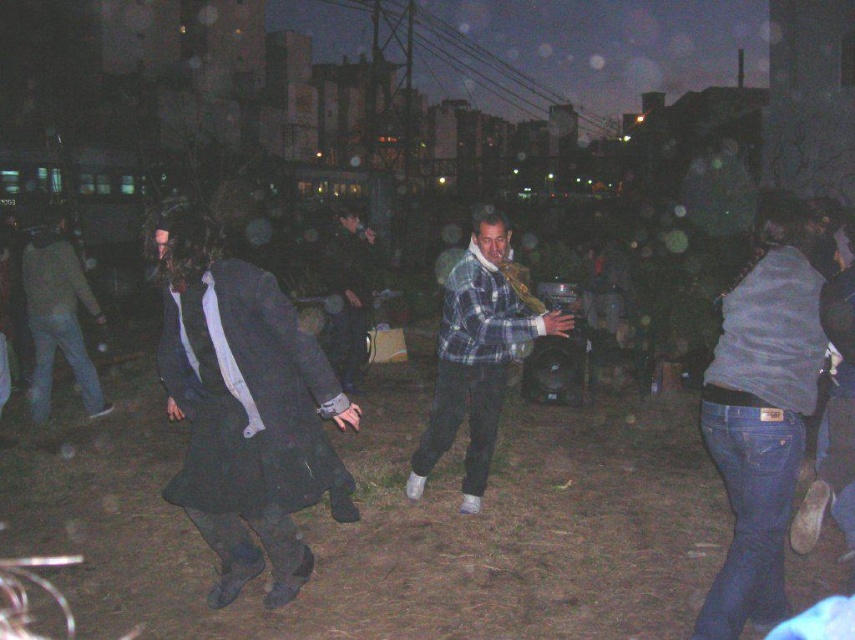
Question: Can you confirm if plaid flannel shirt at center is positioned to the right of dark gray flannel shirt at center?

Choices:
 (A) no
 (B) yes

Answer: (B)

Question: Which object appears closest to the camera in this image?

Choices:
 (A) dark gray flannel shirt at center
 (B) plaid flannel shirt at center
 (C) dark gray coat at center

Answer: (B)

Question: Based on their relative distances, which object is farther from the plaid flannel shirt at center?

Choices:
 (A) dark gray coat at center
 (B) dark gray flannel shirt at center

Answer: (A)

Question: Which point is closer to the camera taking this photo?

Choices:
 (A) (28, 397)
 (B) (463, 333)
 (C) (342, 212)

Answer: (B)

Question: Can you confirm if plaid flannel shirt at center is bigger than dark gray coat at center?

Choices:
 (A) no
 (B) yes

Answer: (B)

Question: Is dark gray coat at center wider than dark gray flannel shirt at center?

Choices:
 (A) no
 (B) yes

Answer: (B)